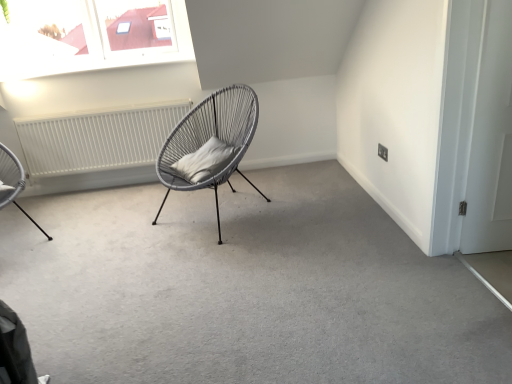
Find the location of `vacant space underneath metallic wire chair at left, which is the second chair from right to left (from a real-world perspective)`. vacant space underneath metallic wire chair at left, which is the second chair from right to left (from a real-world perspective) is located at coordinates (15, 233).